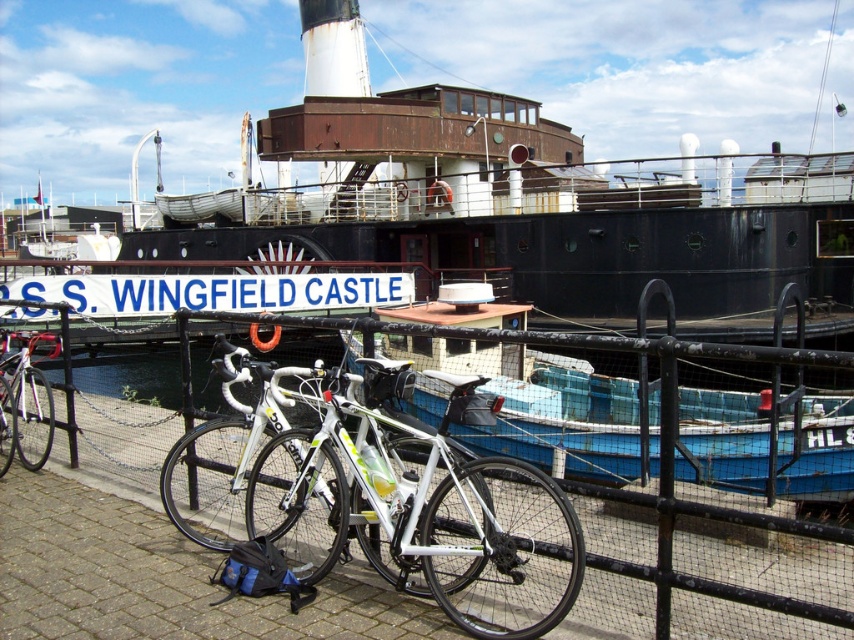
You are a delivery person who needs to load both the white glossy bicycle at center and the blue plastic boat at center onto a truck. The truck has a height restriction of 1.8 meters. Can both items be loaded without removing any parts?

The white glossy bicycle at center is taller than the blue plastic boat at center. Since the truck has a height restriction of 1.8 meters, we need to know the exact heights of both items to determine if they can be loaded. However, the description only states their relative height, not their absolute measurements. Therefore, it is uncertain whether both items can fit without further information.

You are a delivery person who needs to place a large package on the paved area near the black metal railing. The package is too heavy to lift. You see the white glossy bicycle at center and the blue plastic boat at center. Which object should you move to make space?

The white glossy bicycle at center is positioned over the blue plastic boat at center, so you should move the white glossy bicycle at center to create space for the package.

Consider the image. You are standing at the edge of the dock looking at the maritime scene. You need to locate the black metal fence at lower center. According to the coordinates given, where exactly is it positioned in the image?

The black metal fence at lower center is positioned at the coordinates point (529, 561) in the image.